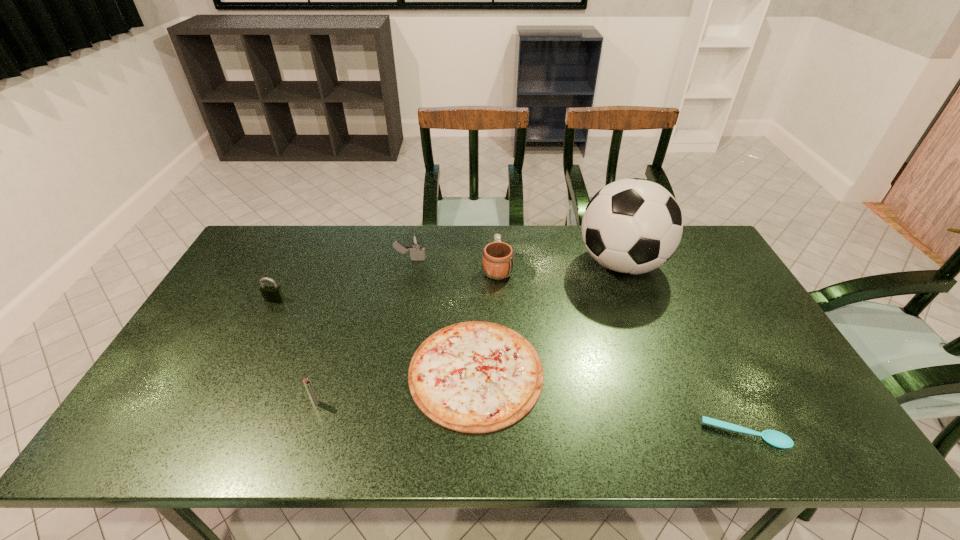
The height and width of the screenshot is (540, 960). I want to click on mug that is at the far edge, so click(x=498, y=257).

What are the coordinates of `pizza that is at the near edge` in the screenshot? It's located at (473, 377).

The height and width of the screenshot is (540, 960). Identify the location of spoon positioned at the near edge. (777, 439).

Where is `object positioned at the left edge`? This screenshot has width=960, height=540. object positioned at the left edge is located at coordinates (273, 294).

Where is `object positioned at the right edge`? object positioned at the right edge is located at coordinates (777, 439).

Where is `object located in the near right corner section of the desktop`? object located in the near right corner section of the desktop is located at coordinates (777, 439).

Where is `vacant space at the far edge of the desktop`? vacant space at the far edge of the desktop is located at coordinates (308, 245).

At what (x,y) coordinates should I click in order to perform the action: click on vacant space at the near edge of the desktop. Please return your answer as a coordinate pair (x, y). This screenshot has height=540, width=960. Looking at the image, I should click on (387, 446).

What are the coordinates of `free spot at the left edge of the desktop` in the screenshot? It's located at [249, 312].

The image size is (960, 540). In the image, there is a desktop. In order to click on vacant space at the right edge in this screenshot , I will do `click(740, 349)`.